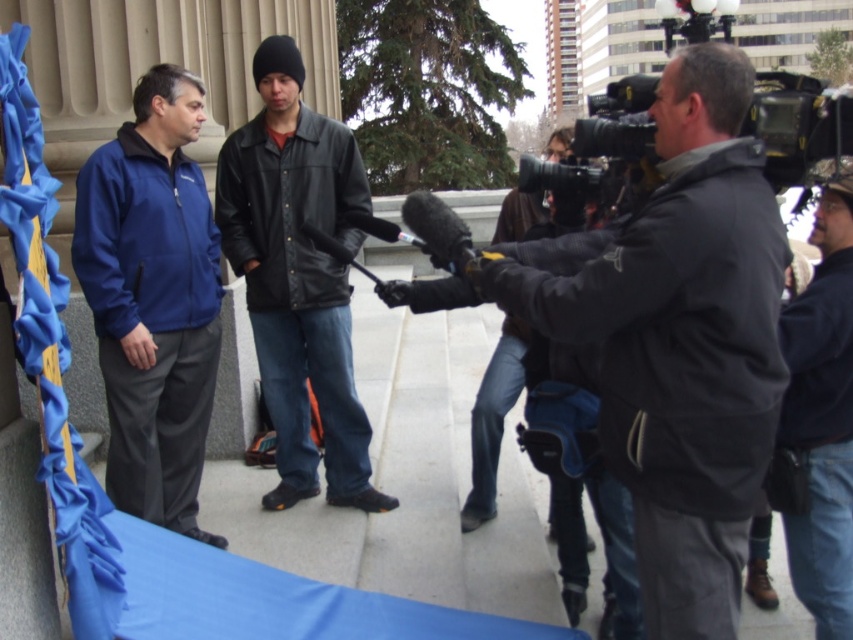
You are standing at the center of the image and want to locate the dark gray jacket at center. Which direction should you look to find it?

The dark gray jacket at center is located at point 0.536 on the x axis and 0.800 on the y axis. Since you are at the center, you should look slightly to the right and upwards to find it.

You are a photographer standing at the center of the scene. You want to take a photo of the dark gray jacket at center. Where should you aim your camera to capture it in the frame?

You should aim your camera at the point 0.536 on the x axis and 0.800 on the y axis to capture the dark gray jacket at center.

You are a photographer positioned at the point marked by the coordinates point (154, 300). You need to capture a photo of the matte blue jacket at left and the black leather jacket at right. Which jacket is closer to your current position?

The matte blue jacket at left is closer to your current position marked by point (154, 300) because the point marks the location of the matte blue jacket at left.